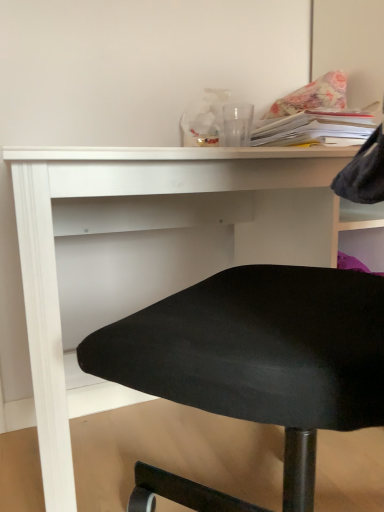
Question: Does white paper stack at upper right have a smaller size compared to white matte desk at center?

Choices:
 (A) no
 (B) yes

Answer: (B)

Question: From a real-world perspective, is white paper stack at upper right physically below white matte desk at center?

Choices:
 (A) no
 (B) yes

Answer: (A)

Question: Is white paper stack at upper right positioned with its back to white matte desk at center?

Choices:
 (A) no
 (B) yes

Answer: (A)

Question: Does white paper stack at upper right have a lesser height compared to white matte desk at center?

Choices:
 (A) no
 (B) yes

Answer: (B)

Question: Does white paper stack at upper right come behind white matte desk at center?

Choices:
 (A) yes
 (B) no

Answer: (A)

Question: From the image's perspective, does white paper stack at upper right appear lower than white matte desk at center?

Choices:
 (A) yes
 (B) no

Answer: (B)

Question: Is white paper stack at upper right located within white matte desk at center?

Choices:
 (A) no
 (B) yes

Answer: (A)

Question: Does white matte desk at center turn towards white paper stack at upper right?

Choices:
 (A) no
 (B) yes

Answer: (A)

Question: Can you confirm if white matte desk at center is positioned to the right of white paper stack at upper right?

Choices:
 (A) yes
 (B) no

Answer: (B)

Question: Is white matte desk at center not near white paper stack at upper right?

Choices:
 (A) no
 (B) yes

Answer: (A)

Question: Can you confirm if white matte desk at center is wider than white paper stack at upper right?

Choices:
 (A) yes
 (B) no

Answer: (A)

Question: Is white matte desk at center taller than white paper stack at upper right?

Choices:
 (A) no
 (B) yes

Answer: (B)

Question: From a real-world perspective, is white paper stack at upper right physically above floral fabric pillow at upper right?

Choices:
 (A) yes
 (B) no

Answer: (B)